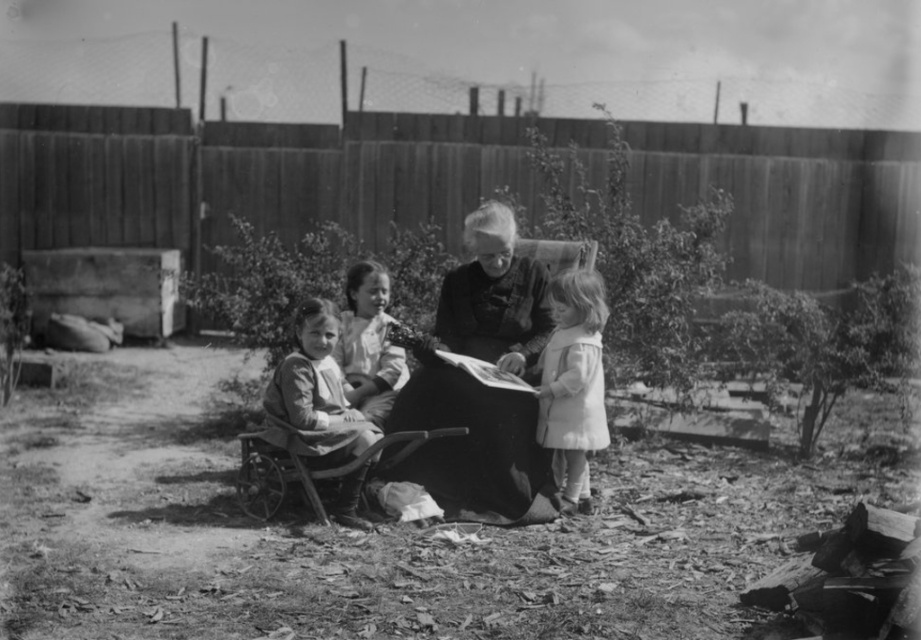
You are a photographer adjusting your camera settings. You notice two black dresses in the image, the matte black dress at center and the smooth black dress at center. Which dress is closer to the camera?

The matte black dress at center is closer to the camera since it is only 2.10 inches away from the smooth black dress at center, indicating proximity in the frame.